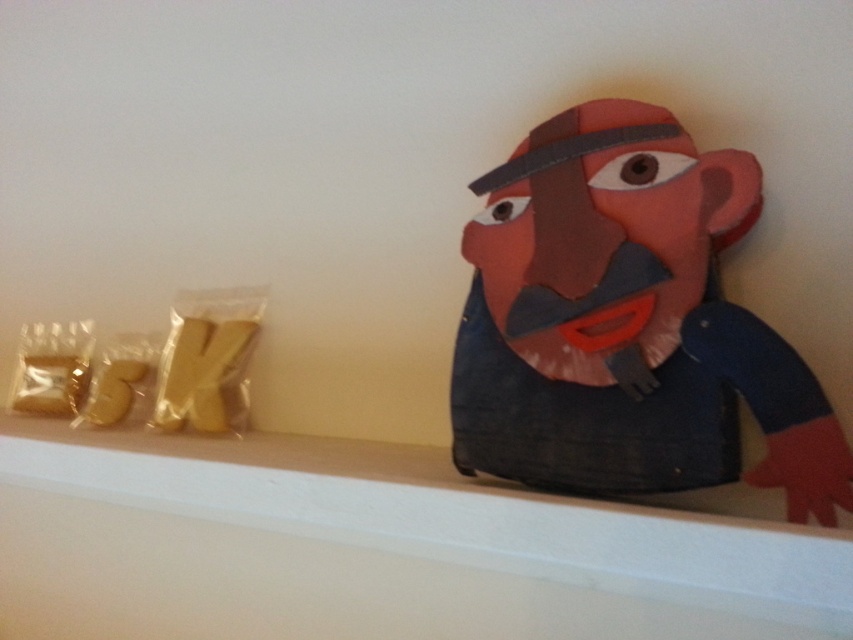
Who is higher up, denim-like paper mask at upper right or white smooth ledge at upper center?

denim-like paper mask at upper right is higher up.

Describe the element at coordinates (628, 323) in the screenshot. I see `denim-like paper mask at upper right` at that location.

This screenshot has width=853, height=640. What are the coordinates of `denim-like paper mask at upper right` in the screenshot? It's located at (628, 323).